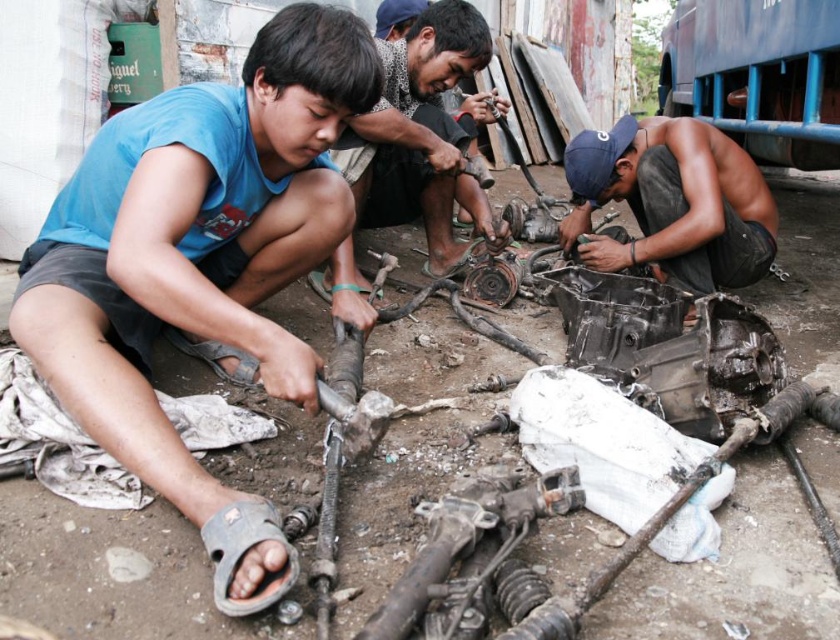
Measure the distance between matte blue shirt at lower left and shiny metallic engine part at center.

matte blue shirt at lower left and shiny metallic engine part at center are 1.46 meters apart from each other.

Is matte blue shirt at lower left in front of shiny metallic engine part at center?

Yes, it is in front of shiny metallic engine part at center.

Between point (285, 72) and point (702, 241), which one is positioned in front?

Point (285, 72) is more forward.

Where is `matte blue shirt at lower left`? This screenshot has width=840, height=640. matte blue shirt at lower left is located at coordinates (200, 266).

Who is shorter, shiny metallic engine part at center or matte black engine part at center?

shiny metallic engine part at center is shorter.

Consider the image. Who is more forward, (x=662, y=131) or (x=371, y=202)?

Positioned in front is point (x=662, y=131).

Locate an element on the screen. shiny metallic engine part at center is located at coordinates (672, 202).

Does point (169, 492) lie behind point (408, 125)?

That is False.

Describe the element at coordinates (200, 266) in the screenshot. I see `matte blue shirt at lower left` at that location.

In order to click on matte blue shirt at lower left in this screenshot , I will do `click(200, 266)`.